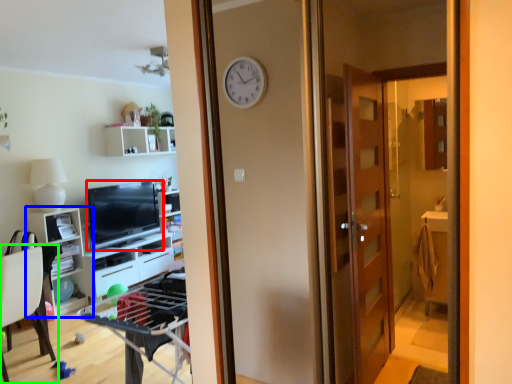
Question: Which is nearer to the television (highlighted by a red box)? cabinetry (highlighted by a blue box) or chair (highlighted by a green box).

Choices:
 (A) cabinetry
 (B) chair

Answer: (A)